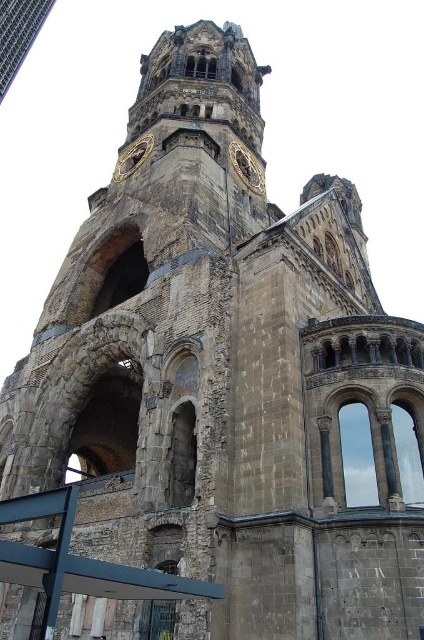
Can you confirm if golden stone clock at upper center is thinner than gold metallic clock at upper center?

Yes.

Consider the image. Which of these two, golden stone clock at upper center or gold metallic clock at upper center, stands shorter?

gold metallic clock at upper center is shorter.

Who is more forward, (259,166) or (136,156)?

Point (136,156) is in front.

Locate an element on the screen. The image size is (424, 640). golden stone clock at upper center is located at coordinates 247,168.